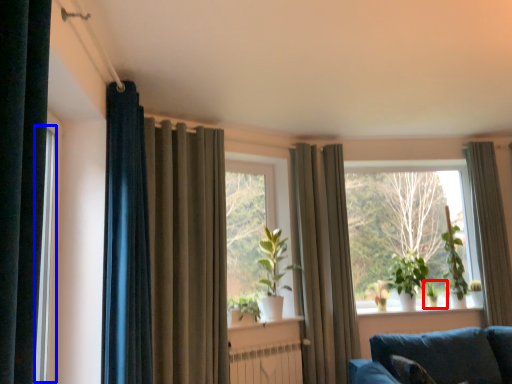
Question: Which point is closer to the camera, plant (highlighted by a red box) or window frame (highlighted by a blue box)?

Choices:
 (A) plant
 (B) window frame

Answer: (B)